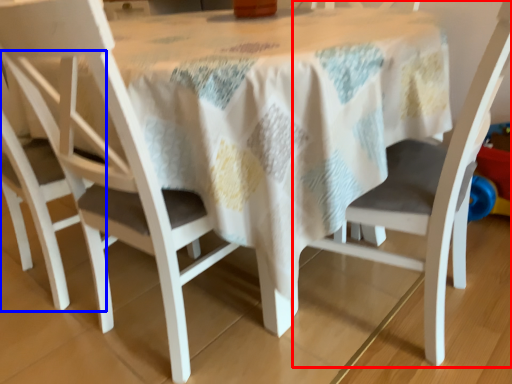
Question: Among these objects, which one is nearest to the camera, chair (highlighted by a red box) or chair (highlighted by a blue box)?

Choices:
 (A) chair
 (B) chair

Answer: (A)